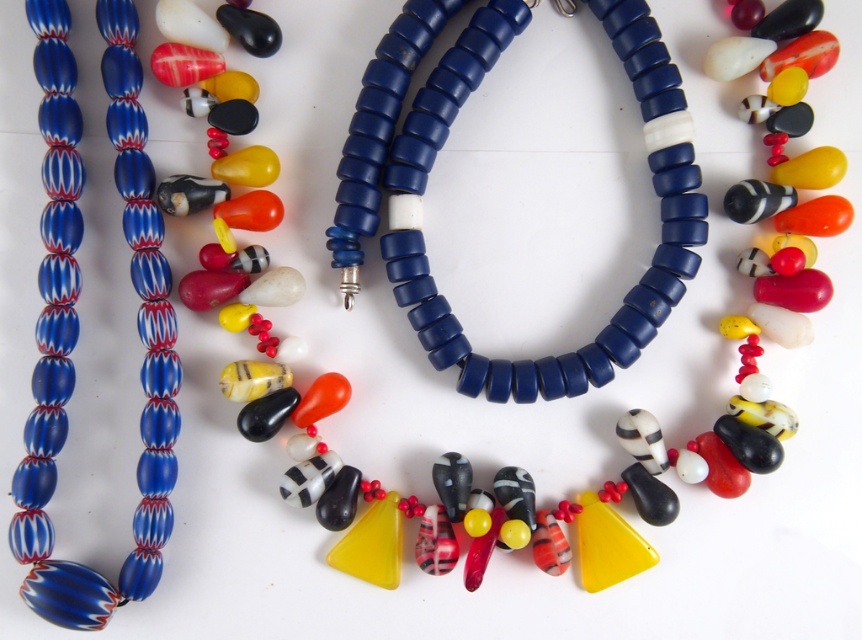
You are an artisan creating a necklace and have the blue matte beads at center and the blue marbled beads at left available. Which bead type would you choose if you want smaller beads for intricate detailing?

The blue matte beads at center are smaller in size compared to the blue marbled beads at left, so they would be better for intricate detailing.

You are looking at the beads arrangement and want to pick up the bead at point [641,90] and the bead at point [28,518]. Which bead will you reach first?

The bead at point [641,90] is closer to you than the bead at point [28,518], so you will reach it first.

You are an artisan creating a necklace and have the blue matte beads at center and the blue marbled beads at left available. Which bead type has a greater width, and why?

The blue matte beads at center have a greater width than the blue marbled beads at left because the description states that the blue matte beads at center are larger in width.